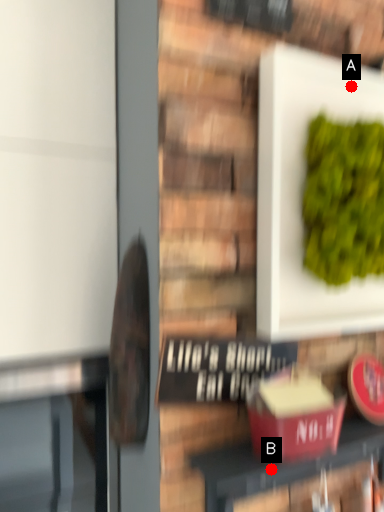
Question: Two points are circled on the image, labeled by A and B beside each circle. Which point is further to the camera?

Choices:
 (A) A is further
 (B) B is further

Answer: (A)